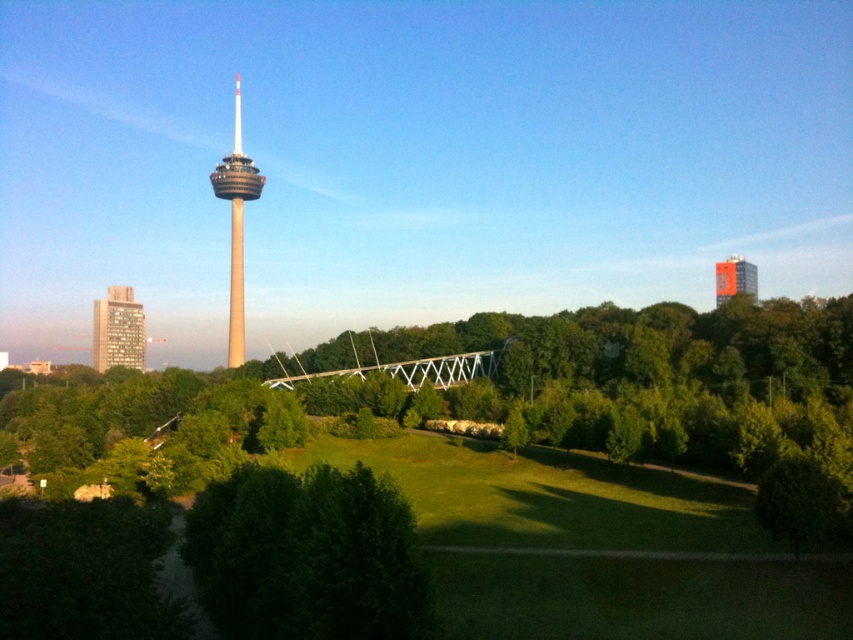
Between green leafy tree at lower left and matte brown building at left, which one is positioned higher?

matte brown building at left is higher up.

Identify the location of green leafy tree at lower left. The width and height of the screenshot is (853, 640). (144, 428).

Does point (160, 476) come in front of point (108, 358)?

Yes, point (160, 476) is closer to viewer.

In order to click on green leafy tree at lower left in this screenshot , I will do `click(144, 428)`.

Does green leafy tree at lower center appear over orange matte building at upper right?

No, green leafy tree at lower center is not above orange matte building at upper right.

Which is above, green leafy tree at lower center or orange matte building at upper right?

orange matte building at upper right is higher up.

Is point (386, 630) closer to viewer compared to point (722, 282)?

Yes, point (386, 630) is in front of point (722, 282).

Locate an element on the screen. The width and height of the screenshot is (853, 640). green leafy tree at lower center is located at coordinates (308, 556).

Which is more to the left, green leafy tree at lower left or beige concrete tower at center-left?

From the viewer's perspective, beige concrete tower at center-left appears more on the left side.

Is green leafy tree at lower left in front of beige concrete tower at center-left?

That is True.

Locate an element on the screen. Image resolution: width=853 pixels, height=640 pixels. green leafy tree at lower left is located at coordinates (144, 428).